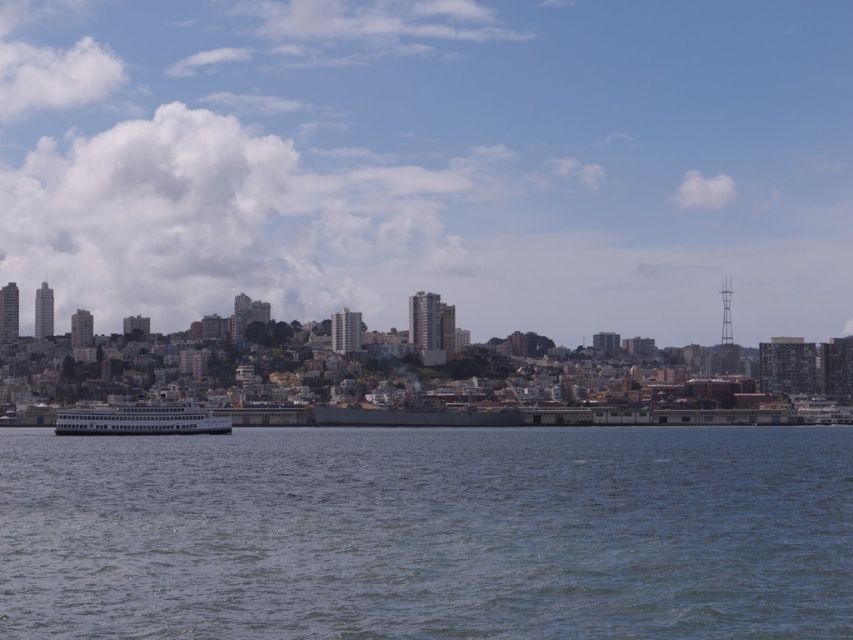
Looking at this image, you are standing on the pier and looking at the blue water at center and the white matte ferry at center. Which object is nearer to you?

The blue water at center is closer to the viewer than the white matte ferry at center.

You are a passenger on the white matte ferry at center and want to jump into the water. Can you jump directly into the blue water at center from your current position?

The blue water at center is located below the white matte ferry at center, so yes, you can jump directly into the blue water at center from your current position.